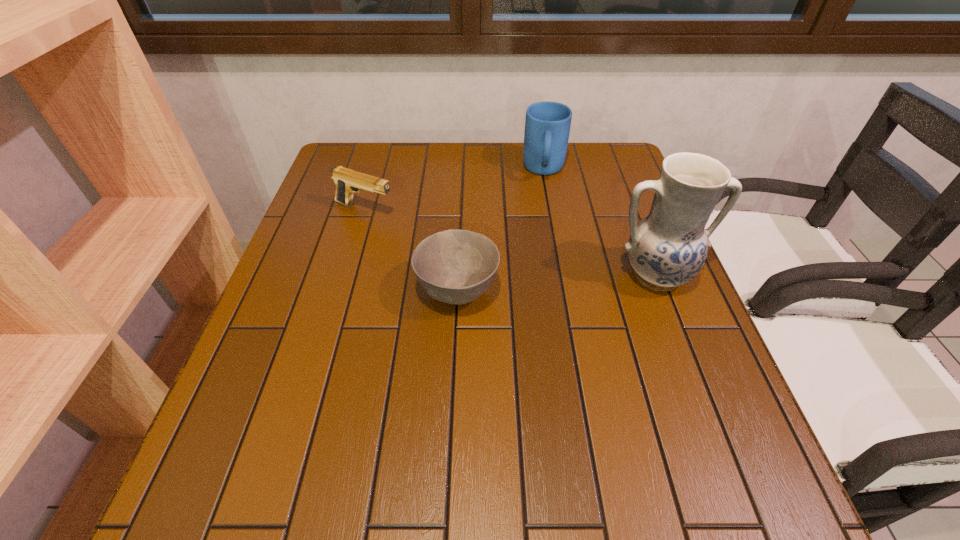
Locate an element on the screen. The width and height of the screenshot is (960, 540). free space at the right edge of the desktop is located at coordinates (598, 248).

What are the coordinates of `vacant space at the far right corner of the desktop` in the screenshot? It's located at click(614, 164).

Image resolution: width=960 pixels, height=540 pixels. I want to click on free location at the near right corner, so click(727, 437).

This screenshot has width=960, height=540. Identify the location of empty location between the bowl and the tallest object. (557, 283).

This screenshot has width=960, height=540. I want to click on free space that is in between the pistol and the rightmost object, so click(x=511, y=242).

The image size is (960, 540). In order to click on free spot between the third nearest object and the third object from right to left in this screenshot , I will do `click(411, 251)`.

What are the coordinates of `vacant area that lies between the third shortest object and the second object from left to right` in the screenshot? It's located at (501, 231).

The image size is (960, 540). Find the location of `free space between the third object from right to left and the pottery`. free space between the third object from right to left and the pottery is located at coordinates (557, 283).

You are a GUI agent. You are given a task and a screenshot of the screen. Output one action in this format:
    pyautogui.click(x=<x>, y=<y>)
    Task: Click on the unoccupied area between the bowl and the farthest object
    The image size is (960, 540).
    Given the screenshot: What is the action you would take?
    pyautogui.click(x=501, y=231)

In order to click on free area in between the farthest object and the third object from right to left in this screenshot , I will do `click(501, 231)`.